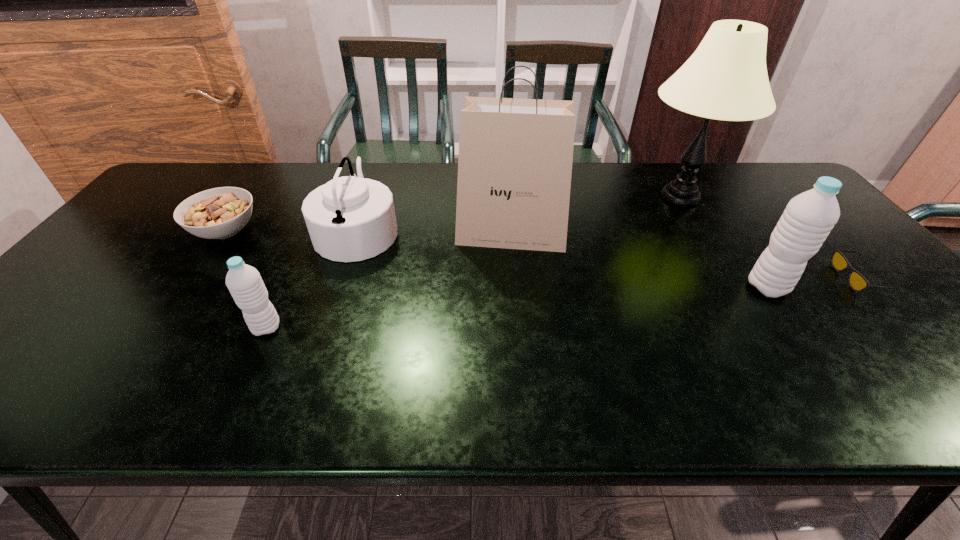
Find the location of a particular element. The height and width of the screenshot is (540, 960). object that is at the far edge is located at coordinates (726, 78).

Identify the location of object that is at the near edge. Image resolution: width=960 pixels, height=540 pixels. (244, 282).

Where is `object situated at the right edge`? object situated at the right edge is located at coordinates (857, 282).

In the image, there is a desktop. At what (x,y) coordinates should I click in order to perform the action: click on vacant area at the far edge. Please return your answer as a coordinate pair (x, y). The height and width of the screenshot is (540, 960). Looking at the image, I should click on (235, 168).

What are the coordinates of `free space at the near edge of the desktop` in the screenshot? It's located at (95, 359).

In the image, there is a desktop. Where is `vacant space at the left edge`? This screenshot has width=960, height=540. vacant space at the left edge is located at coordinates tap(165, 245).

Locate an element on the screen. The height and width of the screenshot is (540, 960). free space at the right edge of the desktop is located at coordinates (778, 201).

In the image, there is a desktop. What are the coordinates of `free space at the near right corner` in the screenshot? It's located at (929, 346).

This screenshot has width=960, height=540. Identify the location of free area in between the fourth object from left to right and the shorter water bottle. (389, 281).

I want to click on unoccupied position between the lamp and the stew, so click(453, 214).